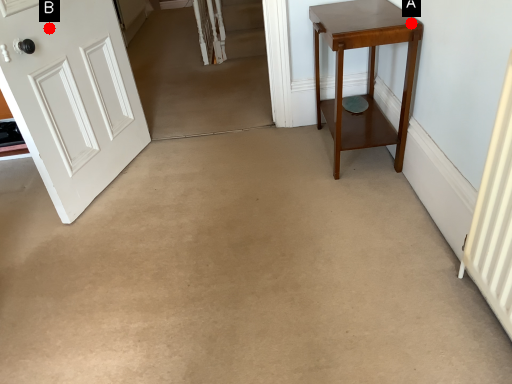
Question: Two points are circled on the image, labeled by A and B beside each circle. Which point is closer to the camera?

Choices:
 (A) A is closer
 (B) B is closer

Answer: (A)